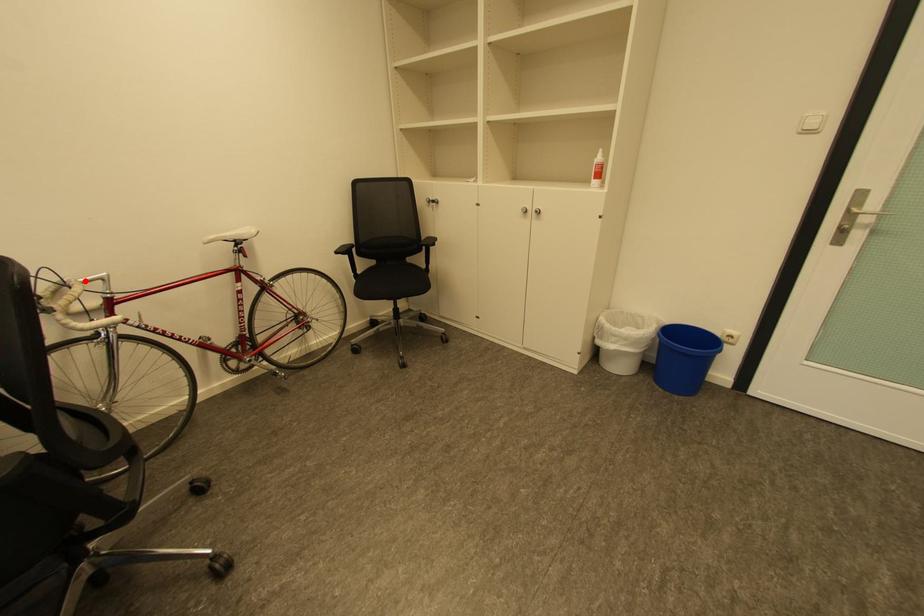
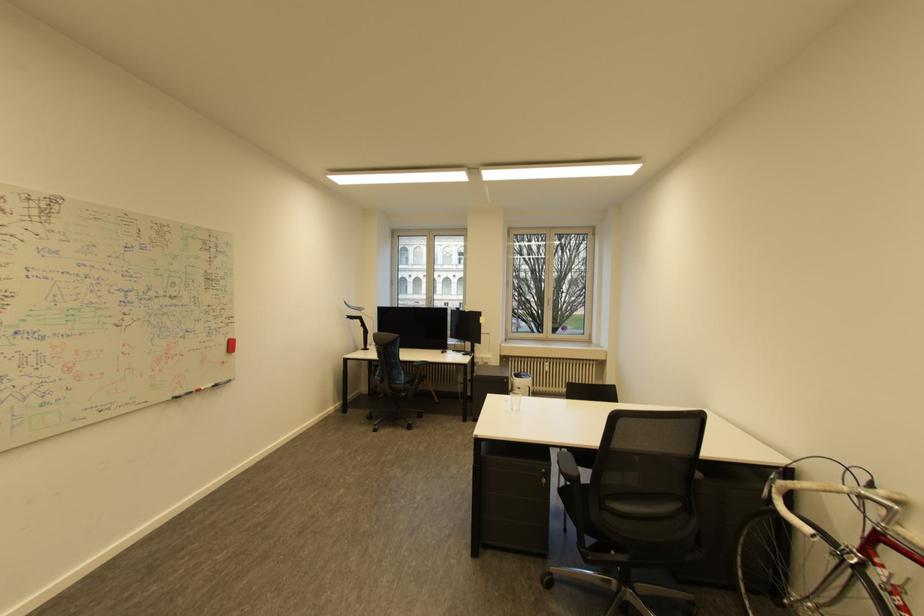
Locate, in the second image, the point that corresponds to the highlighted location in the first image.

(869, 492)